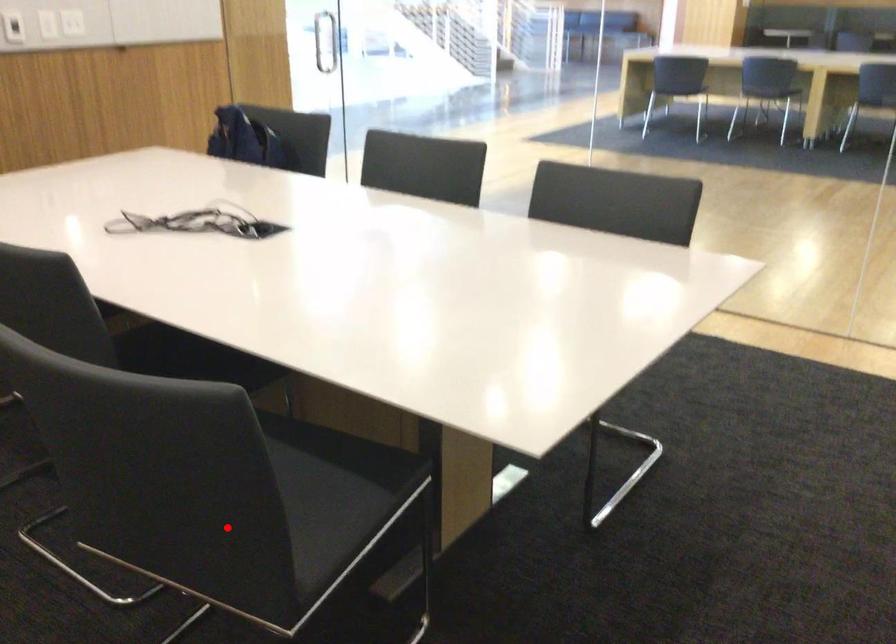
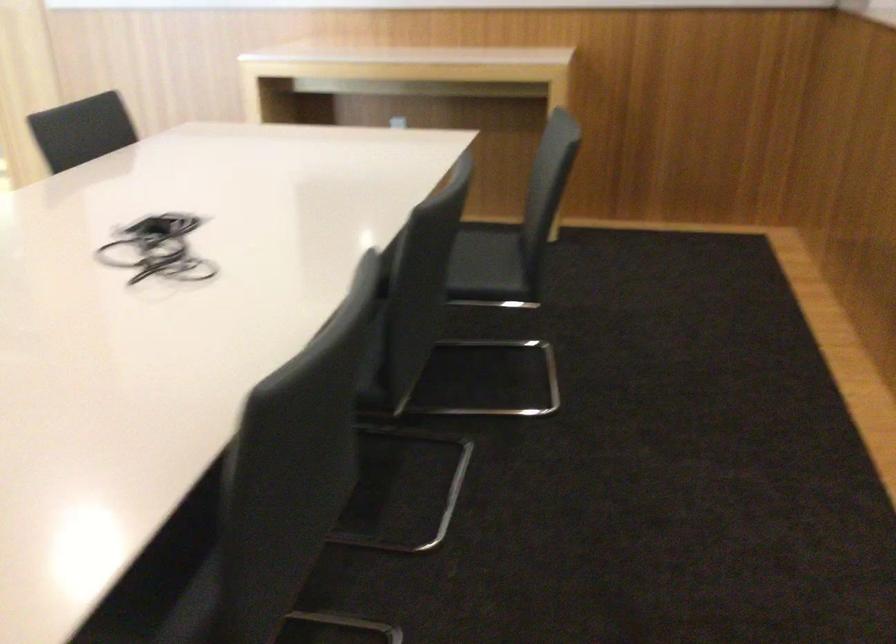
Locate, in the second image, the point that corresponds to the highlighted location in the first image.

(490, 266)